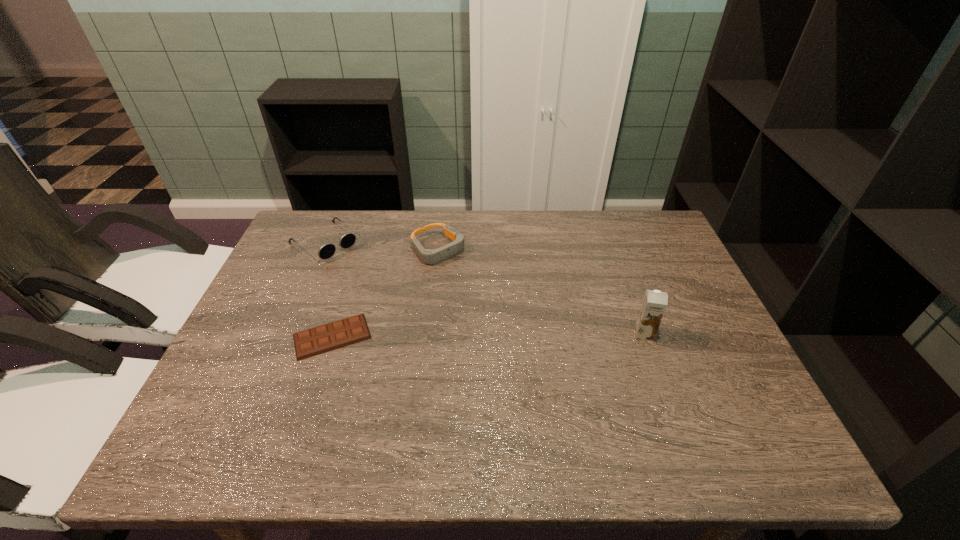
Locate an element on the screen. The width and height of the screenshot is (960, 540). free space on the desktop that is between the chocolate bar and the rightmost object and is positioned on the front and back of the goggles is located at coordinates (532, 335).

Where is `vacant space on the desktop that is between the chocolate bar and the rightmost object and is positioned on the front-facing side of the sunglasses`? The image size is (960, 540). vacant space on the desktop that is between the chocolate bar and the rightmost object and is positioned on the front-facing side of the sunglasses is located at coordinates (444, 336).